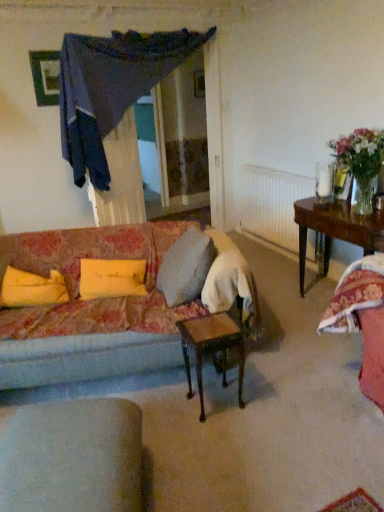
Question: Is light gray fabric chair at lower left wider or thinner than brown wooden table at right, placed as the 2th table when sorted from left to right?

Choices:
 (A) thin
 (B) wide

Answer: (B)

Question: In the image, is light gray fabric chair at lower left on the left side or the right side of brown wooden table at right, the first table from the back?

Choices:
 (A) right
 (B) left

Answer: (B)

Question: Estimate the real-world distances between objects in this image. Which object is farther from the clear glass vase at right?

Choices:
 (A) yellow fabric pillow at left, acting as the 1th pillow starting from the left
 (B) brown wooden table at right, the first table from the back
 (C) floral fabric couch at center
 (D) dark blue fabric at upper center
 (E) translucent glass vase at upper right

Answer: (A)

Question: Which object is positioned closest to the dark blue fabric at upper center?

Choices:
 (A) clear glass vase at right
 (B) wooden table at center, acting as the second table starting from the back
 (C) brown wooden table at right, the first table from the back
 (D) white textured radiator at center
 (E) light gray fabric chair at lower left

Answer: (D)